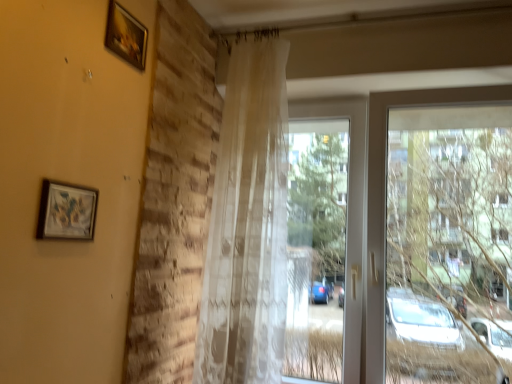
Locate an element on the screen. This screenshot has height=384, width=512. transparent fabric curtain at center is located at coordinates (375, 205).

Describe the element at coordinates (248, 224) in the screenshot. I see `translucent beige curtain at center` at that location.

Identify the location of matte wooden picture frame at upper left, which is the first picture frame from left to right. Image resolution: width=512 pixels, height=384 pixels. (67, 211).

In order to click on wooden frame at upper left, which ranks as the 2th picture frame in front-to-back order in this screenshot , I will do `click(126, 36)`.

Which is in front, wooden frame at upper left, which ranks as the 2th picture frame in front-to-back order, or matte wooden picture frame at upper left, marked as the 1th picture frame in a front-to-back arrangement?

matte wooden picture frame at upper left, marked as the 1th picture frame in a front-to-back arrangement.

From a real-world perspective, which object stands above the other?

wooden frame at upper left, which ranks as the 2th picture frame in front-to-back order, is physically above.

Is transparent fabric curtain at center located outside wooden frame at upper left, the 1th picture frame when ordered from right to left?

transparent fabric curtain at center lies outside wooden frame at upper left, the 1th picture frame when ordered from right to left,'s area.

How many degrees apart are the facing directions of transparent fabric curtain at center and wooden frame at upper left, which ranks as the 2th picture frame in front-to-back order?

The angle between the facing direction of transparent fabric curtain at center and the facing direction of wooden frame at upper left, which ranks as the 2th picture frame in front-to-back order, is 89.7 degrees.

From their relative heights in the image, would you say transparent fabric curtain at center is taller or shorter than wooden frame at upper left, positioned as the 2th picture frame in left-to-right order?

In the image, transparent fabric curtain at center appears to be taller than wooden frame at upper left, positioned as the 2th picture frame in left-to-right order.

From a real-world perspective, does transparent fabric curtain at center stand above wooden frame at upper left, the 1th picture frame when ordered from right to left?

Actually, transparent fabric curtain at center is physically below wooden frame at upper left, the 1th picture frame when ordered from right to left, in the real world.

Consider the image. From a real-world perspective, which object stands above the other?

translucent beige curtain at center, from a real-world perspective.

From the image's perspective, is transparent fabric curtain at center on top of translucent beige curtain at center?

Incorrect, from the image's perspective, transparent fabric curtain at center is lower than translucent beige curtain at center.

Is transparent fabric curtain at center beside translucent beige curtain at center?

transparent fabric curtain at center and translucent beige curtain at center are not in contact.

Is transparent fabric curtain at center positioned with its back to translucent beige curtain at center?

No, transparent fabric curtain at center is not facing the opposite direction of translucent beige curtain at center.

From the image's perspective, is translucent beige curtain at center located beneath transparent fabric curtain at center?

Incorrect, from the image's perspective, translucent beige curtain at center is higher than transparent fabric curtain at center.

Which is behind, point (277, 243) or point (444, 104)?

Point (444, 104)

In terms of size, does translucent beige curtain at center appear bigger or smaller than transparent fabric curtain at center?

translucent beige curtain at center is smaller than transparent fabric curtain at center.

Is matte wooden picture frame at upper left, marked as the first picture frame in a bottom-to-top arrangement, to the left or to the right of translucent beige curtain at center in the image?

matte wooden picture frame at upper left, marked as the first picture frame in a bottom-to-top arrangement, is to the left of translucent beige curtain at center.

Between matte wooden picture frame at upper left, marked as the 1th picture frame in a front-to-back arrangement, and translucent beige curtain at center, which one has larger size?

With larger size is translucent beige curtain at center.

Is matte wooden picture frame at upper left, which is the first picture frame from left to right, oriented towards translucent beige curtain at center?

No, matte wooden picture frame at upper left, which is the first picture frame from left to right, is not aimed at translucent beige curtain at center.

How distant is matte wooden picture frame at upper left, marked as the 1th picture frame in a front-to-back arrangement, from wooden frame at upper left, which ranks as the 2th picture frame in front-to-back order?

The distance of matte wooden picture frame at upper left, marked as the 1th picture frame in a front-to-back arrangement, from wooden frame at upper left, which ranks as the 2th picture frame in front-to-back order, is 54.13 centimeters.

Who is bigger, matte wooden picture frame at upper left, arranged as the 2th picture frame when viewed from the back, or wooden frame at upper left, which appears as the 1th picture frame when viewed from the top?

With larger size is wooden frame at upper left, which appears as the 1th picture frame when viewed from the top.

Does point (73, 198) come in front of point (111, 20)?

Yes, it is.

In the scene shown: Between matte wooden picture frame at upper left, which is the first picture frame from left to right, and wooden frame at upper left, the first picture frame from the back, which one has smaller width?

With smaller width is matte wooden picture frame at upper left, which is the first picture frame from left to right.

From the image's perspective, is transparent fabric curtain at center above or below matte wooden picture frame at upper left, marked as the first picture frame in a bottom-to-top arrangement?

Based on their image positions, transparent fabric curtain at center is located beneath matte wooden picture frame at upper left, marked as the first picture frame in a bottom-to-top arrangement.

Locate an element on the screen. This screenshot has height=384, width=512. the 2nd picture frame to the left of the transparent fabric curtain at center, starting your count from the anchor is located at coordinates (67, 211).

Is transparent fabric curtain at center wider or thinner than matte wooden picture frame at upper left, arranged as the 2th picture frame when viewed from the back?

Clearly, transparent fabric curtain at center has more width compared to matte wooden picture frame at upper left, arranged as the 2th picture frame when viewed from the back.

In the scene shown: Which is more to the right, transparent fabric curtain at center or matte wooden picture frame at upper left, which is the first picture frame from left to right?

Positioned to the right is transparent fabric curtain at center.

Where is `picture frame that is on the right side of matte wooden picture frame at upper left, arranged as the 2th picture frame when viewed from the back`? The image size is (512, 384). picture frame that is on the right side of matte wooden picture frame at upper left, arranged as the 2th picture frame when viewed from the back is located at coordinates (126, 36).

Locate an element on the screen. picture frame that is the 1st one when counting leftward from the transparent fabric curtain at center is located at coordinates (126, 36).

From the image, which object appears to be nearer to matte wooden picture frame at upper left, marked as the 1th picture frame in a front-to-back arrangement, transparent fabric curtain at center or translucent beige curtain at center?

translucent beige curtain at center is closer to matte wooden picture frame at upper left, marked as the 1th picture frame in a front-to-back arrangement.

When comparing their distances from matte wooden picture frame at upper left, which appears as the 2th picture frame when viewed from the top, does translucent beige curtain at center or transparent fabric curtain at center seem further?

Among the two, transparent fabric curtain at center is located further to matte wooden picture frame at upper left, which appears as the 2th picture frame when viewed from the top.

In the scene shown: Estimate the real-world distances between objects in this image. Which object is closer to translucent beige curtain at center, transparent fabric curtain at center or matte wooden picture frame at upper left, marked as the first picture frame in a bottom-to-top arrangement?

transparent fabric curtain at center is positioned closer to the anchor translucent beige curtain at center.

Considering their positions, is wooden frame at upper left, the first picture frame from the back, positioned further to transparent fabric curtain at center than translucent beige curtain at center?

wooden frame at upper left, the first picture frame from the back, is further to transparent fabric curtain at center.

Based on their spatial positions, is translucent beige curtain at center or wooden frame at upper left, the 1th picture frame when ordered from right to left, further from transparent fabric curtain at center?

wooden frame at upper left, the 1th picture frame when ordered from right to left.

Looking at the image, which one is located further to translucent beige curtain at center, transparent fabric curtain at center or wooden frame at upper left, which ranks as the 2th picture frame in front-to-back order?

wooden frame at upper left, which ranks as the 2th picture frame in front-to-back order, lies further to translucent beige curtain at center than the other object.

From the image, which object appears to be farther from wooden frame at upper left, the first picture frame from the back, transparent fabric curtain at center or translucent beige curtain at center?

transparent fabric curtain at center lies further to wooden frame at upper left, the first picture frame from the back, than the other object.

Which object lies further to the anchor point translucent beige curtain at center, wooden frame at upper left, positioned as the 2th picture frame in left-to-right order, or transparent fabric curtain at center?

The object further to translucent beige curtain at center is wooden frame at upper left, positioned as the 2th picture frame in left-to-right order.

Locate an element on the screen. Image resolution: width=512 pixels, height=384 pixels. curtain between wooden frame at upper left, the first picture frame from the back, and matte wooden picture frame at upper left, marked as the 1th picture frame in a front-to-back arrangement, in the up-down direction is located at coordinates (248, 224).

Find the location of `curtain between matte wooden picture frame at upper left, which is the first picture frame from left to right, and transparent fabric curtain at center`. curtain between matte wooden picture frame at upper left, which is the first picture frame from left to right, and transparent fabric curtain at center is located at coordinates (248, 224).

The image size is (512, 384). I want to click on curtain between wooden frame at upper left, which appears as the 1th picture frame when viewed from the top, and transparent fabric curtain at center, in the horizontal direction, so click(248, 224).

Find the location of a particular element. The width and height of the screenshot is (512, 384). picture frame located between matte wooden picture frame at upper left, which appears as the 2th picture frame when viewed from the top, and transparent fabric curtain at center in the left-right direction is located at coordinates (126, 36).